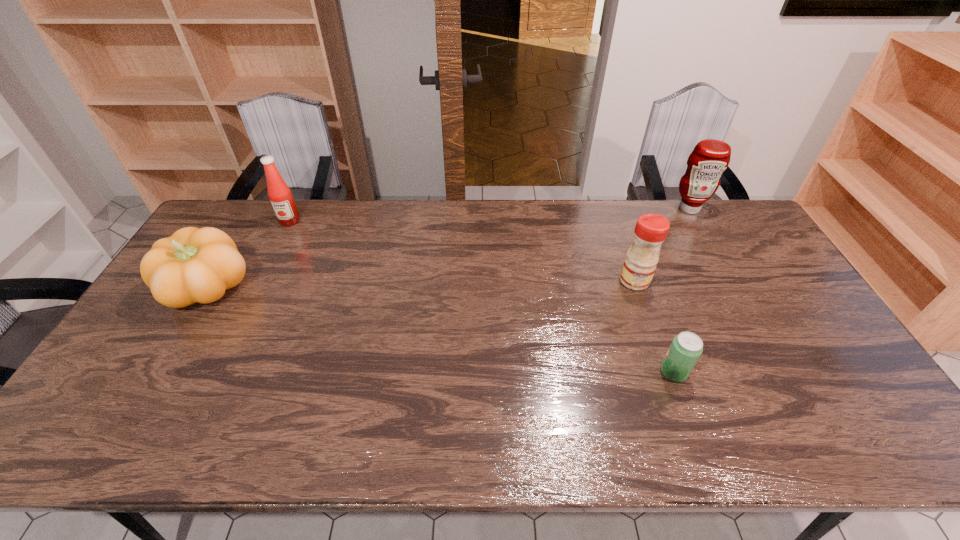
Where is `free space between the shortest object and the rightmost object`? This screenshot has width=960, height=540. free space between the shortest object and the rightmost object is located at coordinates (682, 290).

Locate an element on the screen. The image size is (960, 540). free spot between the soda and the second condiment from right to left is located at coordinates (654, 326).

Where is `vacant area that lies between the rightmost condiment and the leftmost condiment`? The width and height of the screenshot is (960, 540). vacant area that lies between the rightmost condiment and the leftmost condiment is located at coordinates (490, 215).

I want to click on free area in between the second condiment from right to left and the leftmost condiment, so click(x=462, y=251).

Image resolution: width=960 pixels, height=540 pixels. What are the coordinates of `free space between the leftmost condiment and the pumpkin` in the screenshot? It's located at (249, 255).

At what (x,y) coordinates should I click in order to perform the action: click on empty space that is in between the second condiment from left to right and the soda. Please return your answer as a coordinate pair (x, y). Looking at the image, I should click on (654, 326).

The image size is (960, 540). What are the coordinates of `vacant point located between the pumpkin and the soda` in the screenshot? It's located at (441, 330).

Find the location of a particular element. The image size is (960, 540). empty space between the leftmost condiment and the pumpkin is located at coordinates (249, 255).

The image size is (960, 540). I want to click on the closest object to the nearest condiment, so click(686, 348).

At what (x,y) coordinates should I click in order to perform the action: click on object that is the fourth closest to the nearest condiment. Please return your answer as a coordinate pair (x, y). The image size is (960, 540). Looking at the image, I should click on (193, 265).